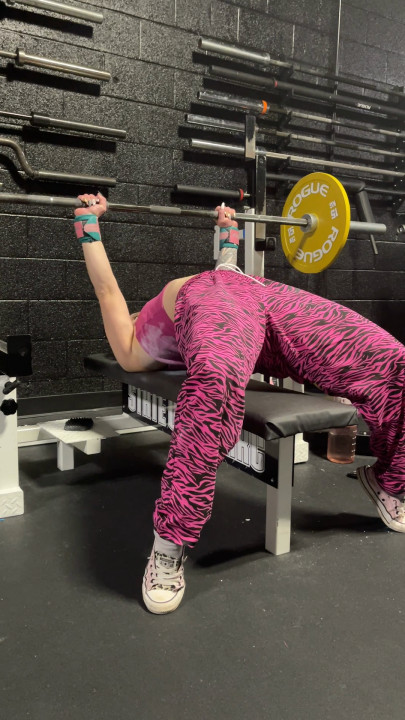
Locate an element on the screen. The height and width of the screenshot is (720, 405). bench is located at coordinates (291, 413).